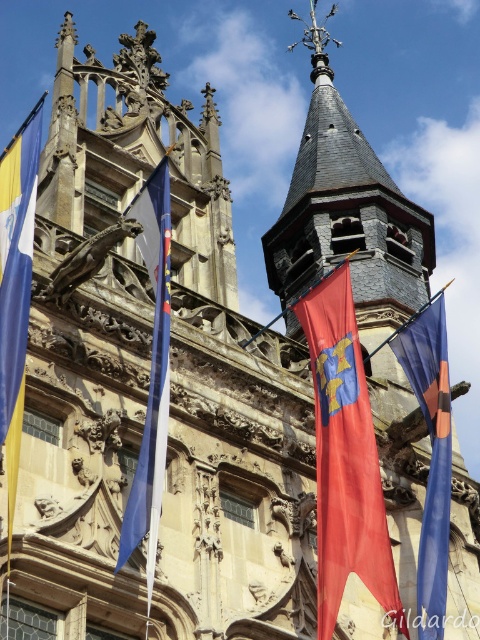
Question: Is blue fabric flag at right thinner than blue fabric flag at center?

Choices:
 (A) no
 (B) yes

Answer: (A)

Question: Which point is closer to the camera?

Choices:
 (A) blue fabric flag at right
 (B) red fabric flag at center
 (C) yellowmatteflag at left

Answer: (C)

Question: Which point is closer to the camera?

Choices:
 (A) blue fabric flag at right
 (B) red fabric flag at center
 (C) blue fabric flag at center

Answer: (C)

Question: Does blue fabric flag at center have a lesser width compared to yellowmatteflag at left?

Choices:
 (A) no
 (B) yes

Answer: (B)

Question: Considering the real-world distances, which object is closest to the red fabric flag at center?

Choices:
 (A) blue fabric flag at right
 (B) blue fabric flag at center

Answer: (A)

Question: Is blue fabric flag at right closer to camera compared to blue fabric flag at center?

Choices:
 (A) yes
 (B) no

Answer: (B)